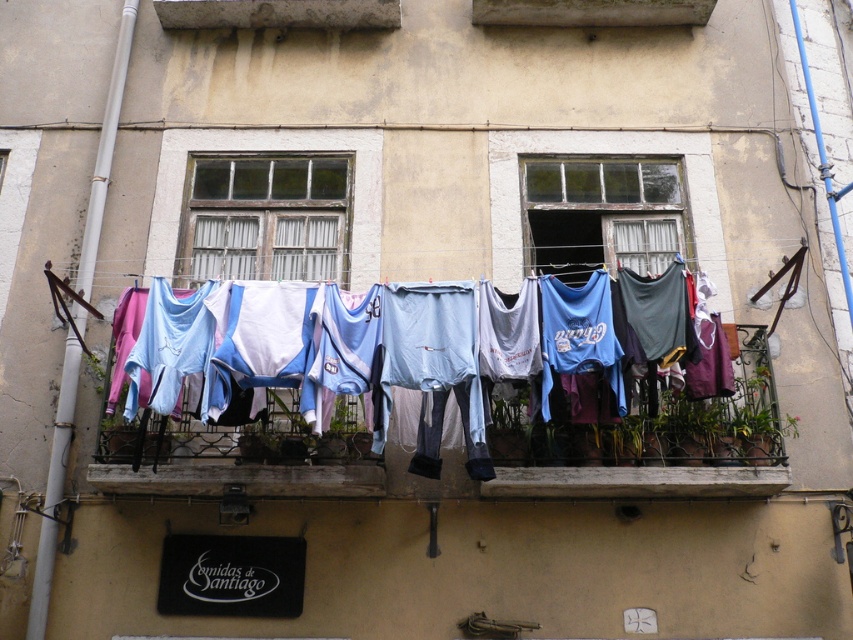
Question: Can you confirm if fabric clothes at center is bigger than wooden frame at upper left?

Choices:
 (A) no
 (B) yes

Answer: (B)

Question: Which of the following is the farthest from the observer?

Choices:
 (A) (575, 262)
 (B) (244, 205)

Answer: (A)

Question: Based on their relative distances, which object is nearer to the transparent glass window at center?

Choices:
 (A) fabric clothes at center
 (B) wooden frame at upper left

Answer: (B)

Question: Does fabric clothes at center have a smaller size compared to wooden frame at upper left?

Choices:
 (A) yes
 (B) no

Answer: (B)

Question: Which object is the closest to the transparent glass window at center?

Choices:
 (A) wooden frame at upper left
 (B) fabric clothes at center

Answer: (A)

Question: Is wooden frame at upper left to the left of transparent glass window at center from the viewer's perspective?

Choices:
 (A) yes
 (B) no

Answer: (A)